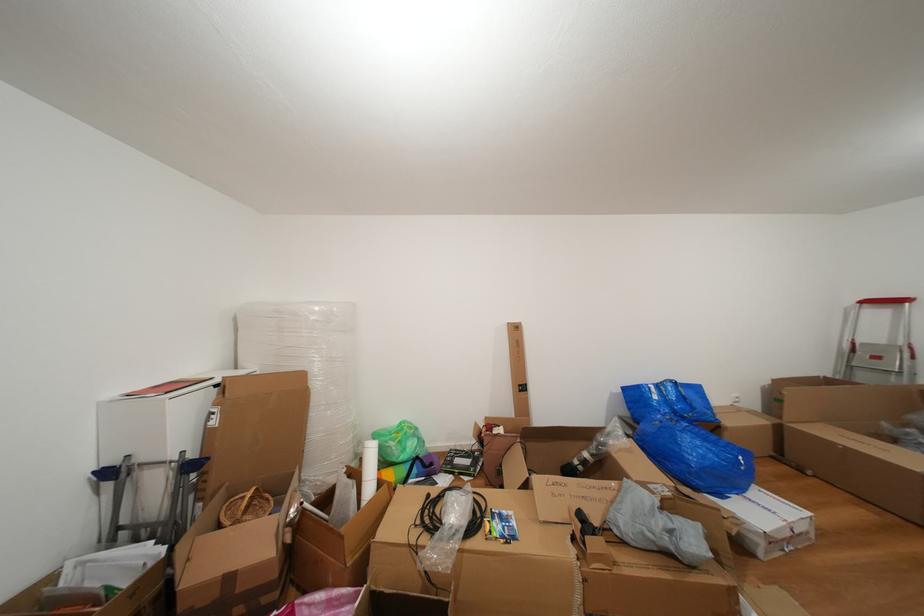
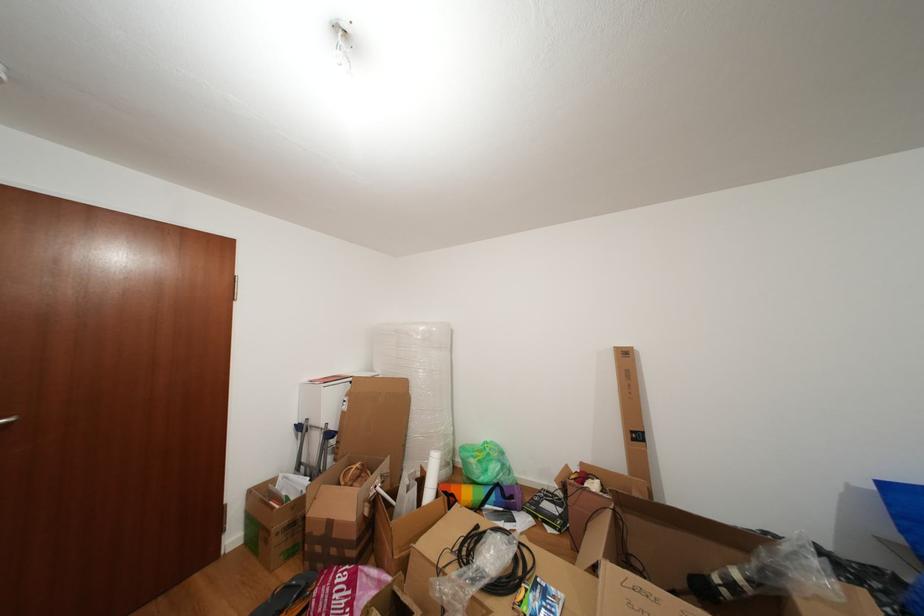
In the second image, find the point that corresponds to pixel 390 540 in the first image.

(431, 548)